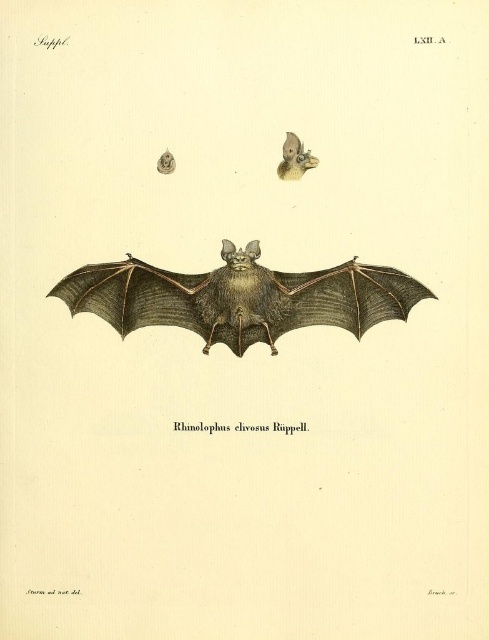
Consider the image. Looking at the scientific illustration of the bat species Rhinolophus chivosus Ruppell, you notice two distinct parts of the bat depicted. The brown textured bat at center and the smooth beige bat head at upper center. Which of these two parts is bigger in size?

The brown textured bat at center is larger in size compared to the smooth beige bat head at upper center.

Based on the photo, you are a wildlife photographer standing at a safe distance from the brown textured bat at center. Your camera has a maximum zoom range of 2.5 meters. Can you capture a clear closeup of the bat without moving closer?

The brown textured bat at center is 3.11 meters away from the viewer. Since your camera can only zoom up to 2.5 meters, you cannot capture a clear closeup without moving closer.

You are an entomologist examining the bat illustration. You notice two points labeled as point 1 and point 2. Point 1 is at coordinates point (x=256, y=269) and point 2 is at point (x=285, y=170). Which point is closer to your eyes?

Point (x=256, y=269) is closer to the camera than point (x=285, y=170).